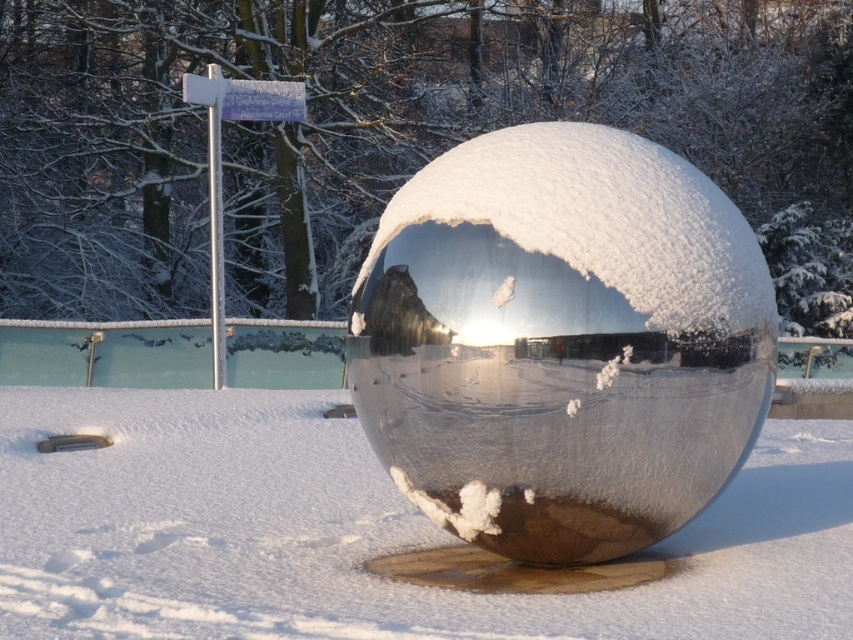
Which of these two, shiny metallic sphere at center or white fluffy snow at center, stands shorter?

Standing shorter between the two is white fluffy snow at center.

Can you confirm if shiny metallic sphere at center is positioned below white fluffy snow at center?

Actually, shiny metallic sphere at center is above white fluffy snow at center.

I want to click on shiny metallic sphere at center, so click(561, 340).